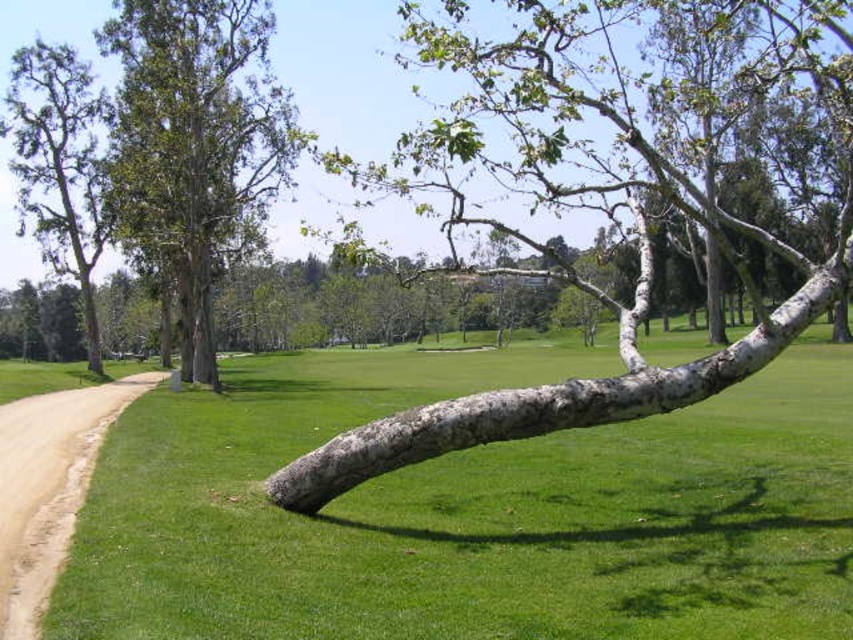
Question: Which point is closer to the camera?

Choices:
 (A) (193, 241)
 (B) (85, 292)

Answer: (A)

Question: Is green grass at center to the left of smooth gray bark tree at left from the viewer's perspective?

Choices:
 (A) yes
 (B) no

Answer: (B)

Question: Can you confirm if green grass at center is positioned above smooth gray bark tree at left?

Choices:
 (A) yes
 (B) no

Answer: (B)

Question: Which point is closer to the camera?

Choices:
 (A) white textured bark at center
 (B) smooth gray bark tree at left
 (C) green grass at center

Answer: (C)

Question: Where is green grass at center located in relation to green leafy tree at upper left in the image?

Choices:
 (A) above
 (B) below

Answer: (B)

Question: Which of these objects is positioned farthest from the brown dirt track at left?

Choices:
 (A) smooth gray bark tree at left
 (B) white textured bark at center
 (C) green leafy tree at upper left

Answer: (A)